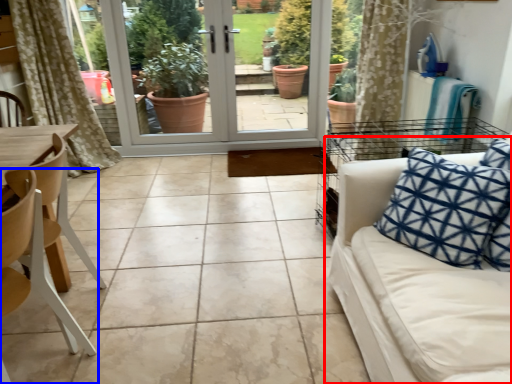
Question: Which point is closer to the camera, studio couch (highlighted by a red box) or chair (highlighted by a blue box)?

Choices:
 (A) studio couch
 (B) chair

Answer: (A)